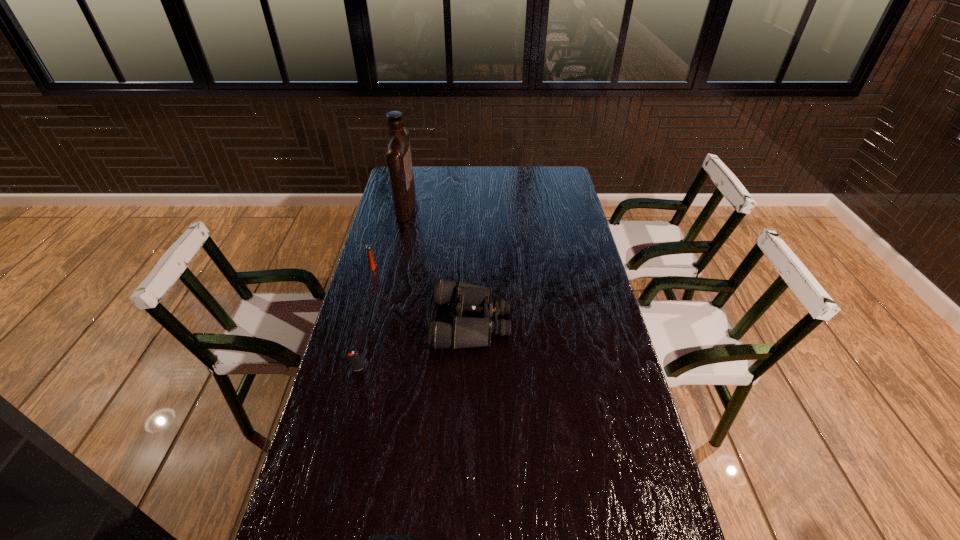
Locate an element on the screen. This screenshot has height=540, width=960. vacant space located 0.070m on the back of the right igniter is located at coordinates (363, 349).

Where is `object that is at the far edge`? The height and width of the screenshot is (540, 960). object that is at the far edge is located at coordinates (399, 160).

Image resolution: width=960 pixels, height=540 pixels. Identify the location of liquor located at the left edge. (399, 160).

Find the location of a particular element. object present at the far left corner is located at coordinates (399, 160).

Where is `vacant area at the far edge`? This screenshot has width=960, height=540. vacant area at the far edge is located at coordinates (440, 191).

Where is `free region at the left edge of the desktop`? This screenshot has height=540, width=960. free region at the left edge of the desktop is located at coordinates (388, 294).

You are a GUI agent. You are given a task and a screenshot of the screen. Output one action in this format:
    pyautogui.click(x=<x>, y=<y>)
    Task: Click on the free space at the right edge of the desktop
    
    Given the screenshot: What is the action you would take?
    pyautogui.click(x=602, y=295)

The image size is (960, 540). In the image, there is a desktop. Find the location of `vacant space at the far right corner`. vacant space at the far right corner is located at coordinates (547, 191).

The image size is (960, 540). What are the coordinates of `free space between the binoculars and the farthest object` in the screenshot? It's located at (439, 264).

This screenshot has width=960, height=540. I want to click on vacant area that lies between the second tallest object and the binoculars, so click(x=422, y=294).